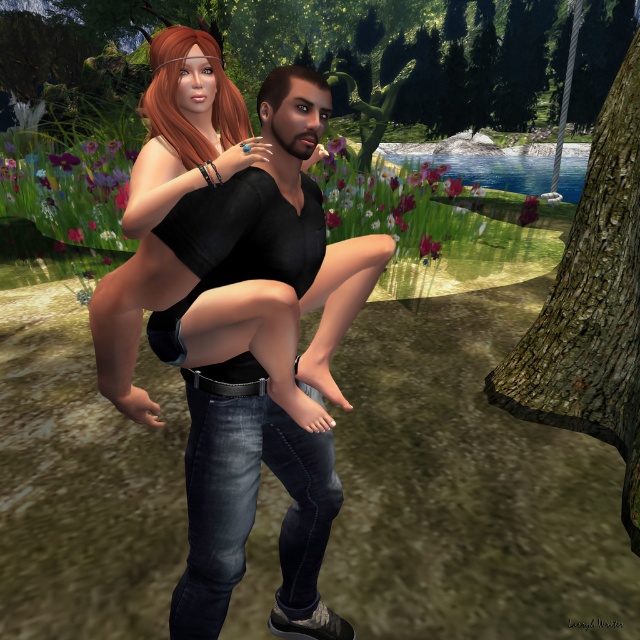
Between matte black top at center and brown rough bark tree at right, which one appears on the right side from the viewer's perspective?

From the viewer's perspective, brown rough bark tree at right appears more on the right side.

Does matte black top at center appear over brown rough bark tree at right?

No.

Locate an element on the screen. matte black top at center is located at coordinates (236, 321).